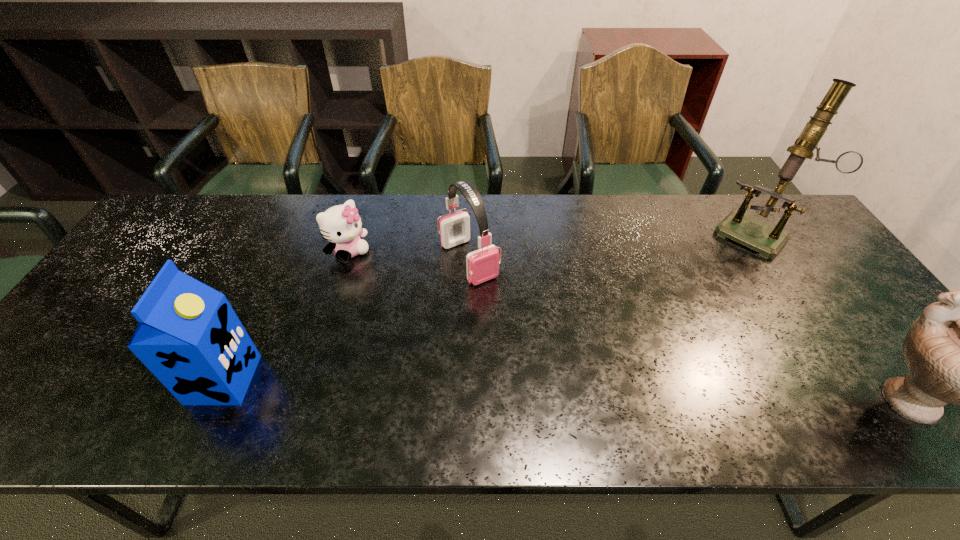
Locate an element on the screen. vacant area situated at the eyepiece of the microscope is located at coordinates (698, 297).

Find the location of `free point located at the eyepiece of the microscope`. free point located at the eyepiece of the microscope is located at coordinates (682, 315).

What are the coordinates of `vacant region located 0.360m at the eyepiece of the microscope` in the screenshot? It's located at (678, 320).

Locate an element on the screen. vacant space located 0.280m on the front-facing side of the kitten is located at coordinates (419, 320).

Identify the location of vacant point located 0.090m on the front-facing side of the kitten. This screenshot has height=540, width=960. (377, 280).

Find the location of a particular element. The height and width of the screenshot is (540, 960). free region located on the front-facing side of the kitten is located at coordinates (390, 292).

The height and width of the screenshot is (540, 960). I want to click on earphone situated at the far edge, so click(x=483, y=264).

Locate an element on the screen. The height and width of the screenshot is (540, 960). microscope that is positioned at the far edge is located at coordinates (768, 240).

I want to click on kitten at the far edge, so click(x=341, y=225).

Where is `object at the near edge`? object at the near edge is located at coordinates (188, 335).